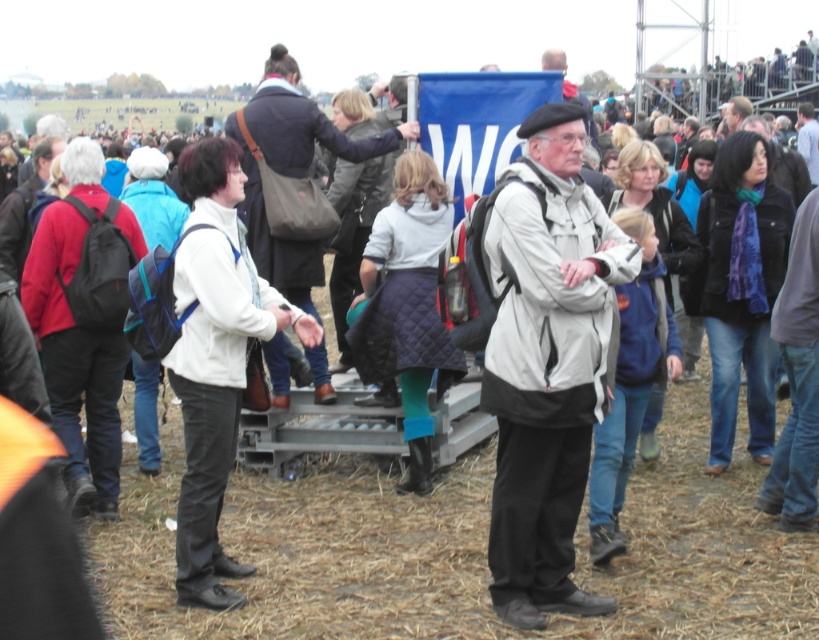
Question: Considering the real-world distances, which object is closest to the white matte jacket at center?

Choices:
 (A) white quilted jacket at center
 (B) light gray jacket at center

Answer: (A)

Question: Is white quilted jacket at center to the left of light gray jacket at center from the viewer's perspective?

Choices:
 (A) yes
 (B) no

Answer: (A)

Question: Can you confirm if white matte jacket at center is positioned above white quilted jacket at center?

Choices:
 (A) no
 (B) yes

Answer: (A)

Question: Which point is farther to the camera?

Choices:
 (A) (810, 124)
 (B) (569, 349)

Answer: (A)

Question: Can you confirm if white matte jacket at center is positioned to the left of white quilted jacket at center?

Choices:
 (A) no
 (B) yes

Answer: (A)

Question: Which point appears farthest from the camera in this image?

Choices:
 (A) (551, 556)
 (B) (802, 147)

Answer: (B)